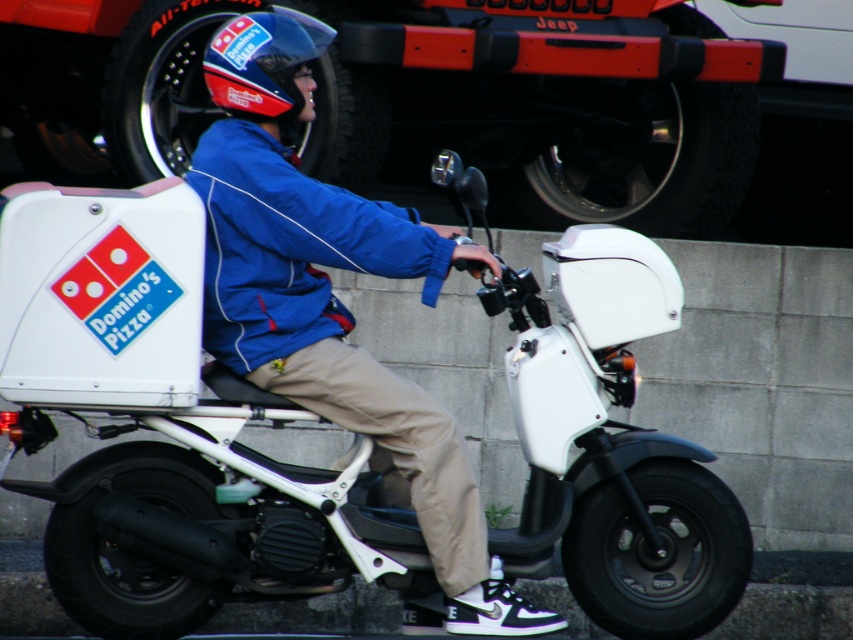
Is white matte motorcycle at center shorter than shiny blue helmet at center?

No.

Can you confirm if white matte motorcycle at center is wider than shiny blue helmet at center?

Yes.

Between point (18, 385) and point (248, 44), which one is positioned behind?

Point (248, 44)

Find the location of a particular element. This screenshot has width=853, height=640. white matte motorcycle at center is located at coordinates (169, 444).

Is white matte motorcycle at center in front of blue fabric jacket at center?

No, white matte motorcycle at center is further to the viewer.

Measure the distance between white matte motorcycle at center and camera.

5.07 meters

Where is `white matte motorcycle at center`? Image resolution: width=853 pixels, height=640 pixels. white matte motorcycle at center is located at coordinates (169, 444).

Between point (321, 202) and point (309, 42), which one is positioned behind?

The point (309, 42) is behind.

Measure the distance between point [422,221] and camera.

Point [422,221] and camera are 20.59 feet apart from each other.

What are the coordinates of `blue fabric jacket at center` in the screenshot? It's located at (334, 301).

Where is `blue fabric jacket at center`? The image size is (853, 640). blue fabric jacket at center is located at coordinates [334, 301].